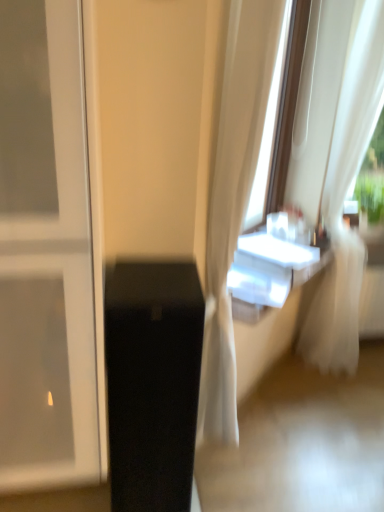
Question: Is black glossy speaker at lower left spatially inside white sheer curtain at right, or outside of it?

Choices:
 (A) inside
 (B) outside

Answer: (B)

Question: Considering the positions of black glossy speaker at lower left and white sheer curtain at right in the image, is black glossy speaker at lower left taller or shorter than white sheer curtain at right?

Choices:
 (A) tall
 (B) short

Answer: (B)

Question: Considering the positions of black glossy speaker at lower left and white sheer curtain at right in the image, is black glossy speaker at lower left bigger or smaller than white sheer curtain at right?

Choices:
 (A) small
 (B) big

Answer: (A)

Question: Visually, is white sheer curtain at right positioned to the left or to the right of black glossy speaker at lower left?

Choices:
 (A) left
 (B) right

Answer: (B)

Question: Considering the positions of white sheer curtain at right and black glossy speaker at lower left in the image, is white sheer curtain at right bigger or smaller than black glossy speaker at lower left?

Choices:
 (A) big
 (B) small

Answer: (A)

Question: From a real-world perspective, is white sheer curtain at right positioned above or below black glossy speaker at lower left?

Choices:
 (A) above
 (B) below

Answer: (A)

Question: From their relative heights in the image, would you say white sheer curtain at right is taller or shorter than black glossy speaker at lower left?

Choices:
 (A) short
 (B) tall

Answer: (B)